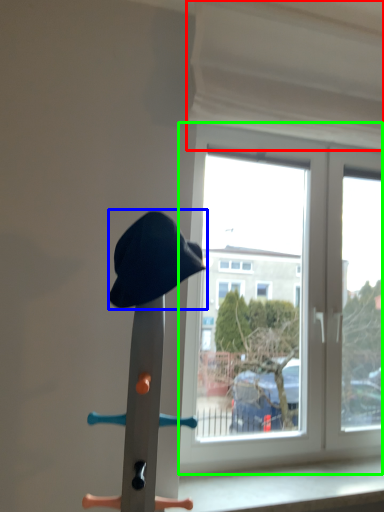
Question: Which object is positioned farthest from curtain (highlighted by a red box)? Select from hat (highlighted by a blue box) and window (highlighted by a green box).

Choices:
 (A) hat
 (B) window

Answer: (A)